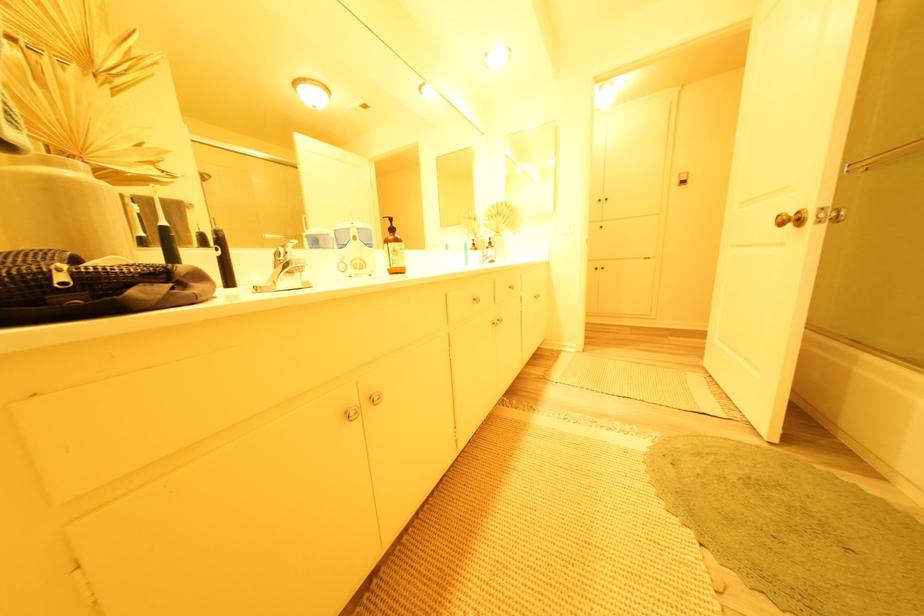
The width and height of the screenshot is (924, 616). I want to click on gold door knob, so click(792, 219).